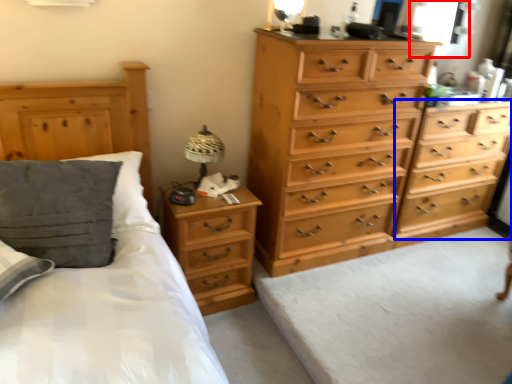
Question: Which point is further to the camera, window (highlighted by a red box) or chest of drawers (highlighted by a blue box)?

Choices:
 (A) window
 (B) chest of drawers

Answer: (A)